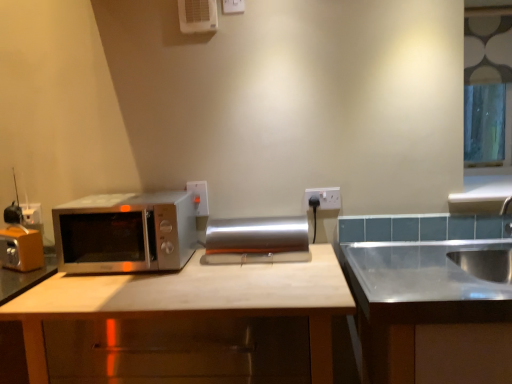
Question: From the image's perspective, is white plastic electric outlet at upper right located above white plastic air conditioner at upper center?

Choices:
 (A) yes
 (B) no

Answer: (B)

Question: Considering the relative sizes of white plastic electric outlet at upper right and white plastic air conditioner at upper center in the image provided, is white plastic electric outlet at upper right taller than white plastic air conditioner at upper center?

Choices:
 (A) no
 (B) yes

Answer: (A)

Question: Is white plastic electric outlet at upper right bigger than white plastic air conditioner at upper center?

Choices:
 (A) yes
 (B) no

Answer: (B)

Question: Is white plastic electric outlet at upper right positioned in front of white plastic air conditioner at upper center?

Choices:
 (A) yes
 (B) no

Answer: (B)

Question: From the image's perspective, is white plastic electric outlet at upper right beneath white plastic air conditioner at upper center?

Choices:
 (A) no
 (B) yes

Answer: (B)

Question: Would you say white plastic air conditioner at upper center is part of white plastic electric outlet at upper right's contents?

Choices:
 (A) yes
 (B) no

Answer: (B)

Question: Is matte wood cabinet at center, which appears as the second cabinetry when viewed from the right, surrounded by satin silver sink at right, positioned as the first cabinetry in right-to-left order?

Choices:
 (A) no
 (B) yes

Answer: (A)

Question: Considering the relative sizes of satin silver sink at right, the second cabinetry viewed from the left, and matte wood cabinet at center, which appears as the second cabinetry when viewed from the right, in the image provided, is satin silver sink at right, the second cabinetry viewed from the left, wider than matte wood cabinet at center, which appears as the second cabinetry when viewed from the right,?

Choices:
 (A) no
 (B) yes

Answer: (B)

Question: Is satin silver sink at right, the second cabinetry viewed from the left, looking in the opposite direction of matte wood cabinet at center, marked as the 1th cabinetry in a left-to-right arrangement?

Choices:
 (A) yes
 (B) no

Answer: (B)

Question: Considering the relative positions of satin silver sink at right, positioned as the first cabinetry in right-to-left order, and matte wood cabinet at center, which appears as the second cabinetry when viewed from the right, in the image provided, is satin silver sink at right, positioned as the first cabinetry in right-to-left order, to the right of matte wood cabinet at center, which appears as the second cabinetry when viewed from the right, from the viewer's perspective?

Choices:
 (A) no
 (B) yes

Answer: (B)

Question: Does satin silver sink at right, the second cabinetry viewed from the left, have a greater height compared to matte wood cabinet at center, marked as the 1th cabinetry in a left-to-right arrangement?

Choices:
 (A) yes
 (B) no

Answer: (A)

Question: Does satin silver sink at right, the second cabinetry viewed from the left, turn towards matte wood cabinet at center, marked as the 1th cabinetry in a left-to-right arrangement?

Choices:
 (A) no
 (B) yes

Answer: (A)

Question: Can you confirm if white plastic air conditioner at upper center is thinner than matte wood cabinet at center, marked as the 1th cabinetry in a left-to-right arrangement?

Choices:
 (A) yes
 (B) no

Answer: (A)